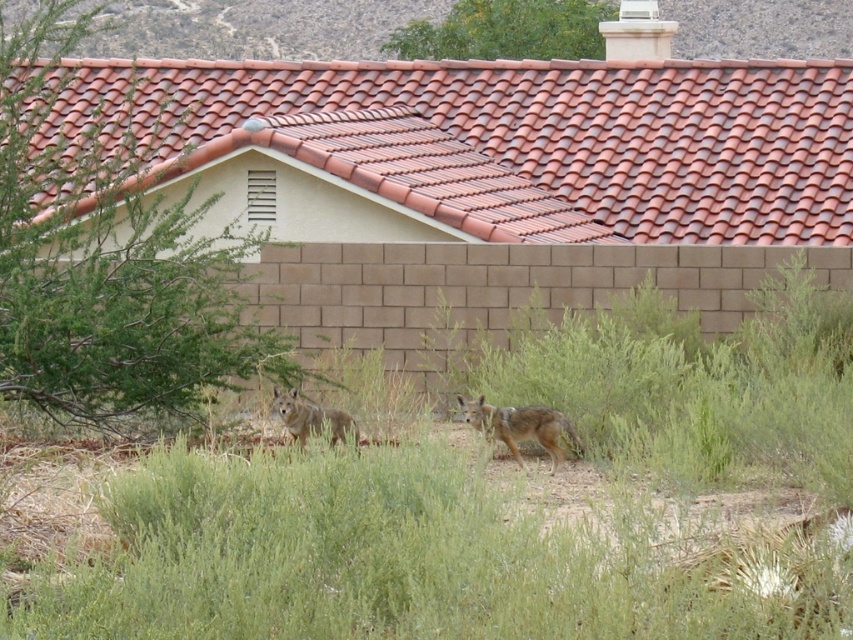
You are a bird looking for a place to perch. You see the terracotta clay tiles at upper center and the green leafy bush at upper center. Which one is taller and would allow you to have a better view of the area?

The terracotta clay tiles at upper center is much taller than the green leafy bush at upper center, so it would provide a better vantage point for the bird.

You are standing in the semi arid suburban area looking at the scene. You want to place a 30 feet long fence between you and the green leafy bush at left. Is the distance sufficient to accommodate the fence?

The distance from you to the green leafy bush at left is 32.98 feet. Since the fence is 30 feet long, it can be placed as the distance is longer than the fence length.